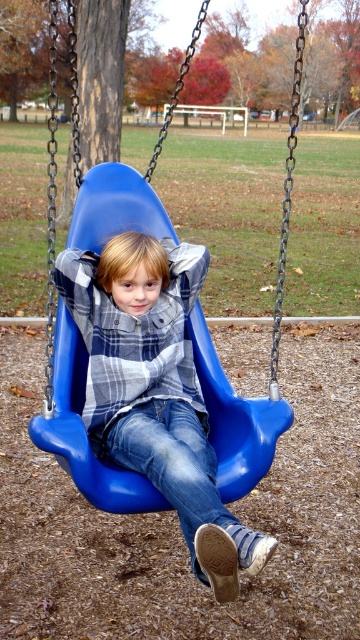
Does blue plastic swing at center have a greater height compared to denim jeans at center?

Correct, blue plastic swing at center is much taller as denim jeans at center.

Who is positioned more to the left, blue plastic swing at center or denim jeans at center?

denim jeans at center is more to the left.

Between point (145, 225) and point (236, 518), which one is positioned behind?

The point (145, 225) is more distant.

Where is `blue plastic swing at center`? blue plastic swing at center is located at coordinates (270, 362).

Between plaid shirt at center and denim jeans at center, which one is positioned higher?

plaid shirt at center is higher up.

Is plaid shirt at center behind denim jeans at center?

No, plaid shirt at center is in front of denim jeans at center.

At what (x,y) coordinates should I click in order to perform the action: click on plaid shirt at center. Please return your answer as a coordinate pair (x, y). Looking at the image, I should click on (155, 390).

At what (x,y) coordinates should I click in order to perform the action: click on plaid shirt at center. Please return your answer as a coordinate pair (x, y). This screenshot has width=360, height=640. Looking at the image, I should click on (155, 390).

Is plaid shirt at center above blue plastic swing at center?

Actually, plaid shirt at center is below blue plastic swing at center.

Is plaid shirt at center thinner than blue plastic swing at center?

Correct, plaid shirt at center's width is less than blue plastic swing at center's.

Is point (171, 369) closer to camera compared to point (271, 376)?

Yes.

In order to click on plaid shirt at center in this screenshot , I will do `click(155, 390)`.